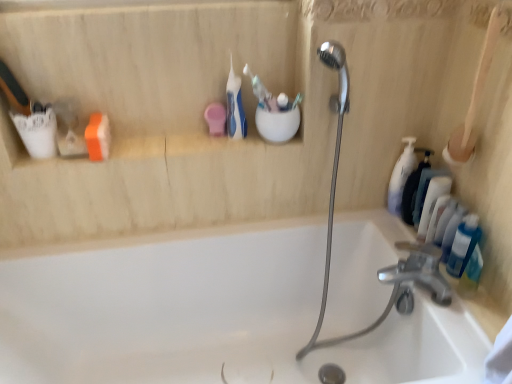
Question: From a real-world perspective, is white glossy soap dispenser at right, acting as the second toiletry starting from the left, on translucent plastic bottles at right, arranged as the first toiletry when viewed from the right?

Choices:
 (A) yes
 (B) no

Answer: (A)

Question: Can you confirm if white glossy soap dispenser at right, the fourth toiletry from the right, is taller than translucent plastic bottles at right, arranged as the first toiletry when viewed from the right?

Choices:
 (A) yes
 (B) no

Answer: (A)

Question: Is white glossy soap dispenser at right, the fourth toiletry from the right, thinner than translucent plastic bottles at right, arranged as the first toiletry when viewed from the right?

Choices:
 (A) yes
 (B) no

Answer: (A)

Question: Is white glossy soap dispenser at right, the fourth toiletry from the right, placed right next to translucent plastic bottles at right, acting as the fifth toiletry starting from the left?

Choices:
 (A) no
 (B) yes

Answer: (A)

Question: Does white glossy soap dispenser at right, acting as the second toiletry starting from the left, have a greater width compared to translucent plastic bottles at right, acting as the fifth toiletry starting from the left?

Choices:
 (A) no
 (B) yes

Answer: (A)

Question: Could you tell me if white glossy soap dispenser at right, acting as the second toiletry starting from the left, is turned towards translucent plastic bottles at right, arranged as the first toiletry when viewed from the right?

Choices:
 (A) no
 (B) yes

Answer: (A)

Question: Is translucent plastic bottles at right, acting as the fifth toiletry starting from the left, far away from white glossy bathtub at center?

Choices:
 (A) yes
 (B) no

Answer: (B)

Question: From the image's perspective, is translucent plastic bottles at right, arranged as the first toiletry when viewed from the right, located beneath white glossy bathtub at center?

Choices:
 (A) yes
 (B) no

Answer: (B)

Question: From a real-world perspective, is translucent plastic bottles at right, acting as the fifth toiletry starting from the left, located higher than white glossy bathtub at center?

Choices:
 (A) no
 (B) yes

Answer: (B)

Question: Can you confirm if translucent plastic bottles at right, acting as the fifth toiletry starting from the left, is positioned to the left of white glossy bathtub at center?

Choices:
 (A) yes
 (B) no

Answer: (B)

Question: Is translucent plastic bottles at right, acting as the fifth toiletry starting from the left, taller than white glossy bathtub at center?

Choices:
 (A) no
 (B) yes

Answer: (A)

Question: Is translucent plastic bottles at right, acting as the fifth toiletry starting from the left, outside of white glossy bathtub at center?

Choices:
 (A) yes
 (B) no

Answer: (A)

Question: Can you confirm if white glossy bathtub at center is taller than white matte pump bottle at right, which is counted as the 5th toiletry, starting from the right?

Choices:
 (A) yes
 (B) no

Answer: (A)